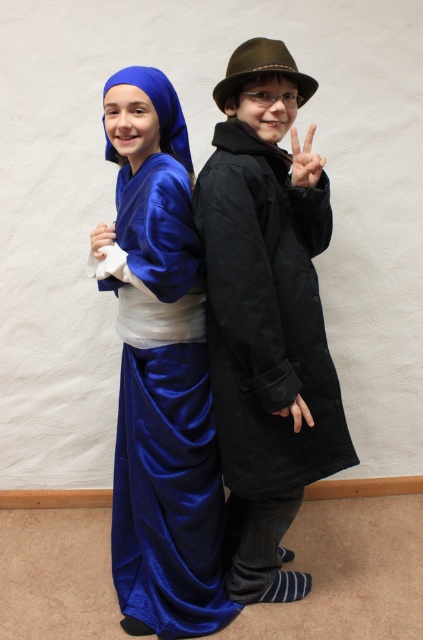
Question: Which object is the closest to the white matte hand at center?

Choices:
 (A) satin blue robe at center
 (B) matte black hand at upper center

Answer: (B)

Question: Is satin blue robe at center thinner than white matte hand at center?

Choices:
 (A) yes
 (B) no

Answer: (B)

Question: Is the position of satin blue robe at center more distant than that of matte black hand at upper center?

Choices:
 (A) yes
 (B) no

Answer: (B)

Question: Which object is closer to the camera taking this photo?

Choices:
 (A) white matte hand at center
 (B) matte black hand at upper center

Answer: (B)

Question: Can you confirm if matte black hand at upper center is thinner than white matte hand at center?

Choices:
 (A) no
 (B) yes

Answer: (A)

Question: Among these points, which one is nearest to the camera?

Choices:
 (A) (104, 241)
 (B) (299, 170)

Answer: (B)